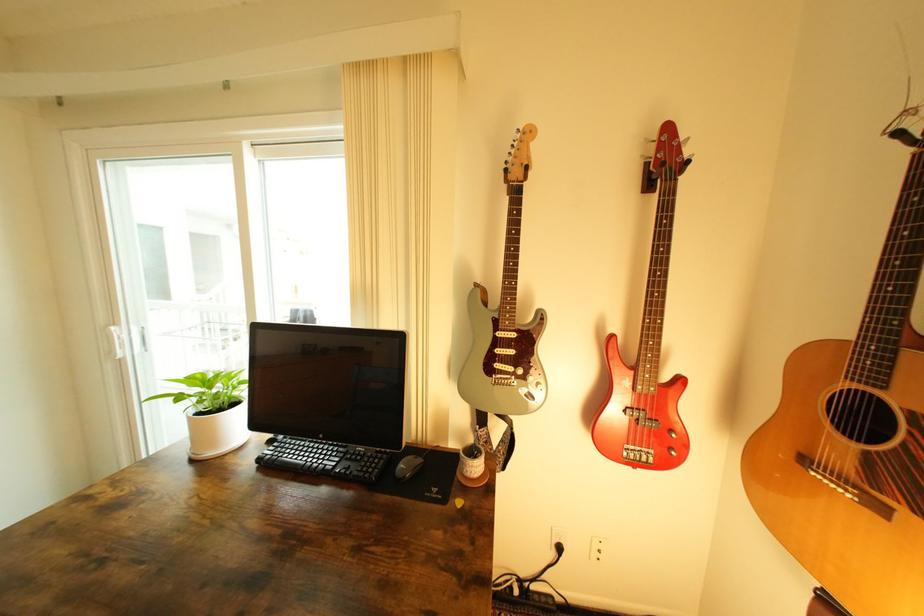
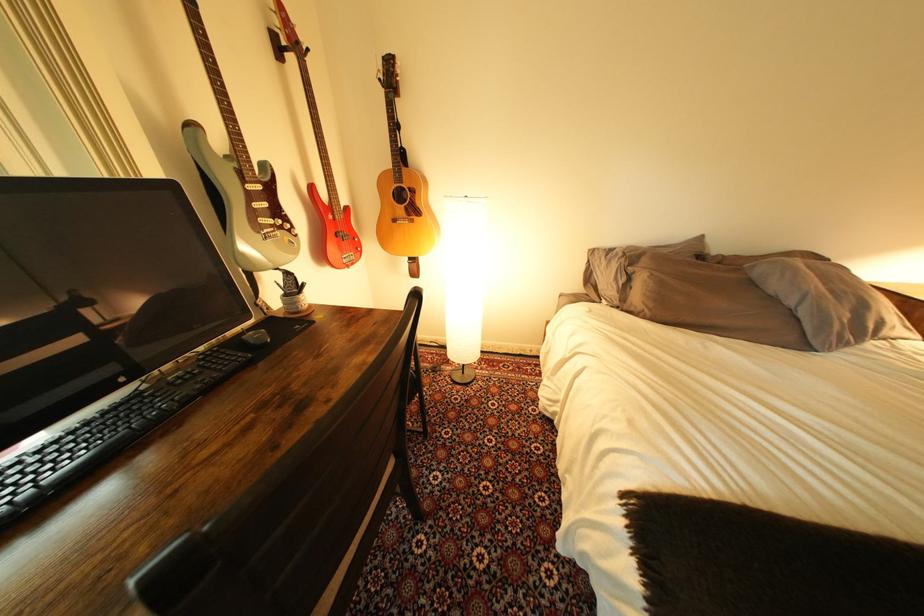
Find the pixel in the second image that matches point (415, 468) in the first image.

(270, 338)